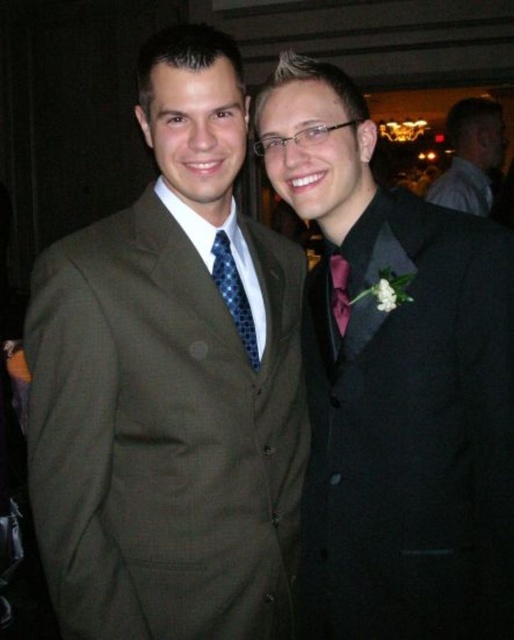
Question: Which of the following is the farthest from the observer?

Choices:
 (A) matte blue tie at right
 (B) matte black suit at upper right
 (C) olive green wool suit at left

Answer: (B)

Question: Which point is closer to the camera taking this photo?

Choices:
 (A) (335, 307)
 (B) (397, 618)

Answer: (B)

Question: Can you confirm if olive green wool suit at left is positioned below matte blue tie at right?

Choices:
 (A) yes
 (B) no

Answer: (A)

Question: Does matte black suit at upper right appear on the right side of matte blue tie at right?

Choices:
 (A) yes
 (B) no

Answer: (A)

Question: Which object appears closest to the camera in this image?

Choices:
 (A) blue dotted tie at center
 (B) olive green wool suit at left
 (C) matte blue tie at right

Answer: (B)

Question: Can you confirm if blue dotted tie at center is positioned above matte blue tie at right?

Choices:
 (A) no
 (B) yes

Answer: (A)